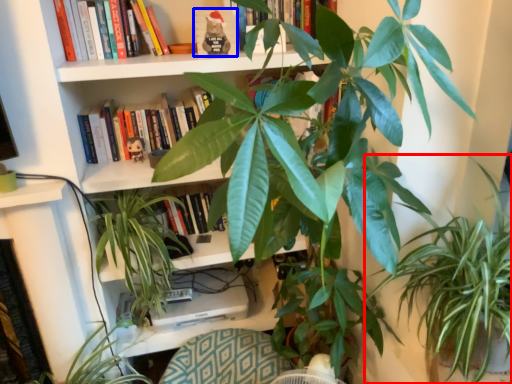
Question: Which of the following is the farthest to the observer, houseplant (highlighted by a red box) or paperback book (highlighted by a blue box)?

Choices:
 (A) houseplant
 (B) paperback book

Answer: (B)